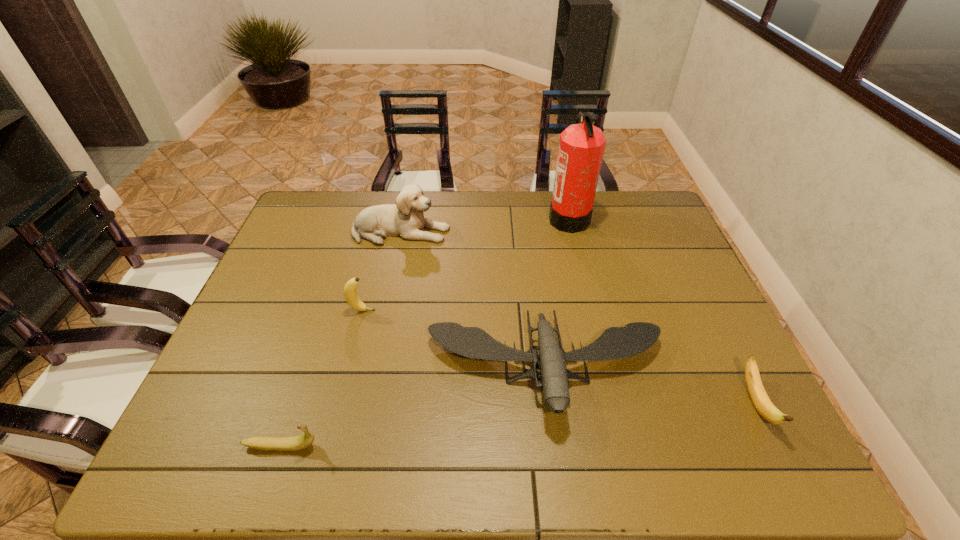
Locate an element on the screen. The width and height of the screenshot is (960, 540). object present at the near left corner is located at coordinates (301, 442).

Image resolution: width=960 pixels, height=540 pixels. In order to click on object located at the near right corner in this screenshot , I will do `click(759, 397)`.

Where is `vacant space at the far edge`? This screenshot has width=960, height=540. vacant space at the far edge is located at coordinates (538, 205).

Identify the location of free spot at the near edge of the desktop. (668, 432).

In order to click on blank space at the left edge of the desktop in this screenshot , I will do `click(236, 375)`.

Where is `vacant space at the right edge of the desktop`? This screenshot has width=960, height=540. vacant space at the right edge of the desktop is located at coordinates (684, 269).

Locate an element on the screen. This screenshot has width=960, height=540. vacant space at the far left corner is located at coordinates pyautogui.click(x=315, y=205).

Where is `empty space that is in between the second farthest banana and the fire extinguisher`? empty space that is in between the second farthest banana and the fire extinguisher is located at coordinates (662, 310).

The image size is (960, 540). Identify the location of vacant space in between the nearest object and the drone. (414, 408).

Identify the location of vacant space that's between the nearest banana and the tallest object. The width and height of the screenshot is (960, 540). (424, 332).